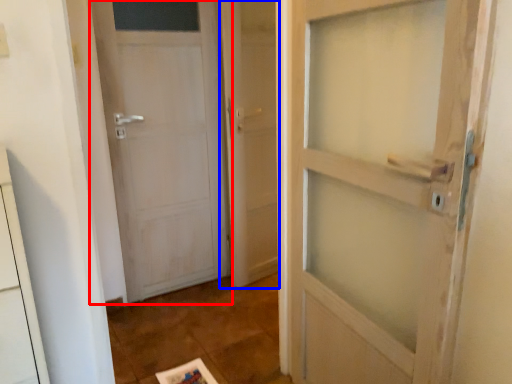
Question: Which of the following is the closest to the observer, door (highlighted by a red box) or screen door (highlighted by a blue box)?

Choices:
 (A) door
 (B) screen door

Answer: (A)